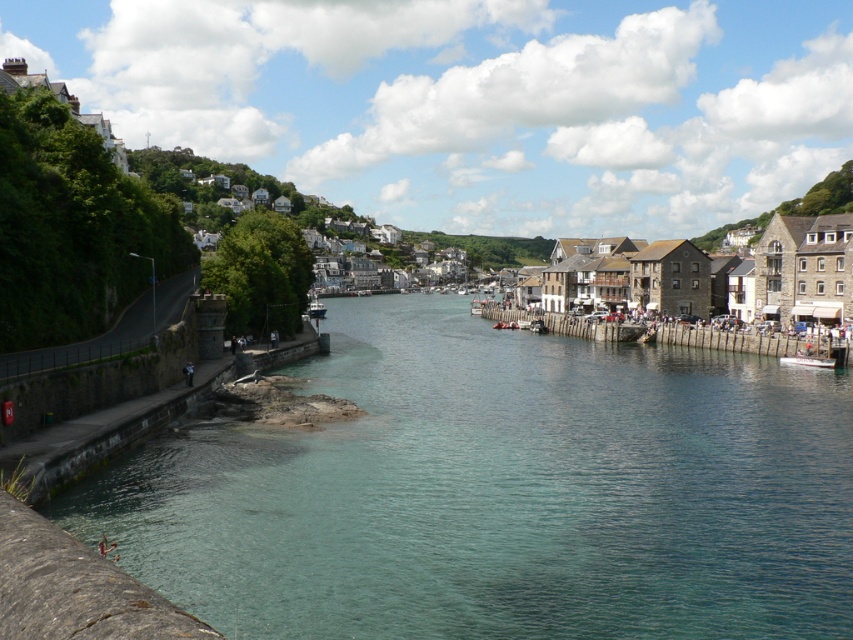
Question: Which point is closer to the camera taking this photo?

Choices:
 (A) (384, 477)
 (B) (321, 310)

Answer: (A)

Question: Is clear water at lower left bigger than metallic silver boat at center?

Choices:
 (A) yes
 (B) no

Answer: (A)

Question: Among these points, which one is nearest to the camera?

Choices:
 (A) (318, 310)
 (B) (782, 360)
 (C) (291, 556)

Answer: (C)

Question: Which object is closer to the camera taking this photo?

Choices:
 (A) clear water at lower left
 (B) metallic silver boat at center

Answer: (A)

Question: Is clear water at lower left positioned in front of white glossy boat at center?

Choices:
 (A) yes
 (B) no

Answer: (A)

Question: Can you confirm if white glossy boat at center is positioned to the right of metallic silver boat at center?

Choices:
 (A) no
 (B) yes

Answer: (B)